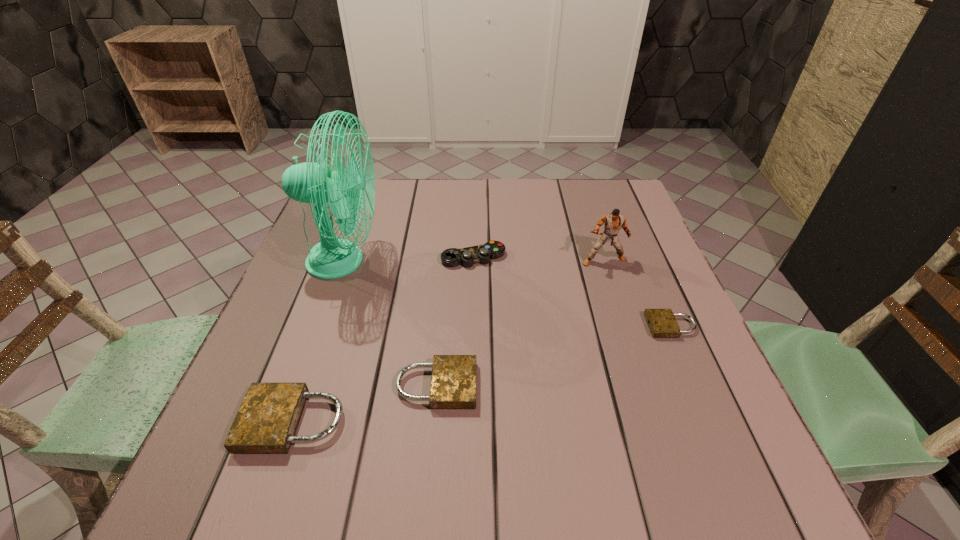
Identify the location of vacant point that satisfies the following two spatial constraints: 1. on the front side of the control; 2. in front of the tallest object to blow air. (473, 261).